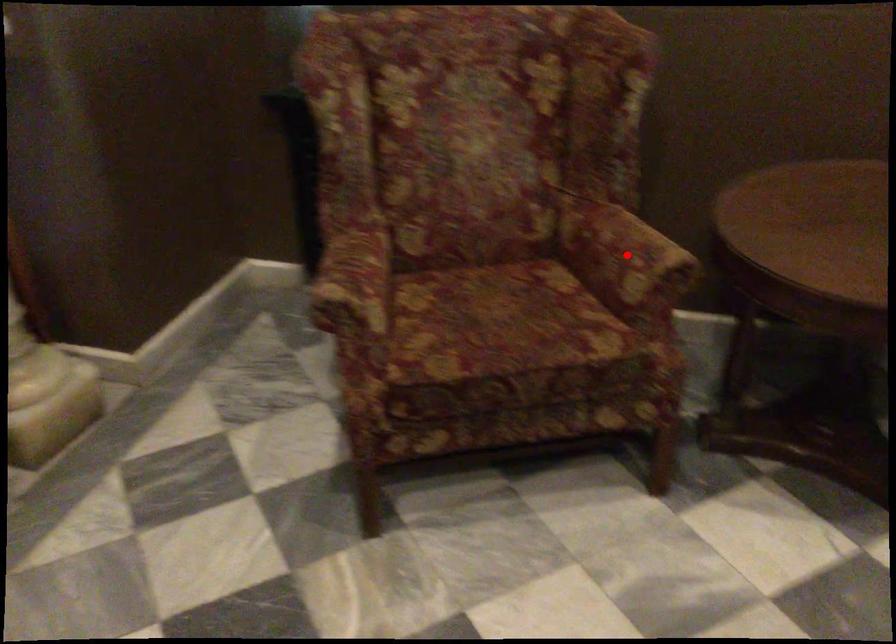
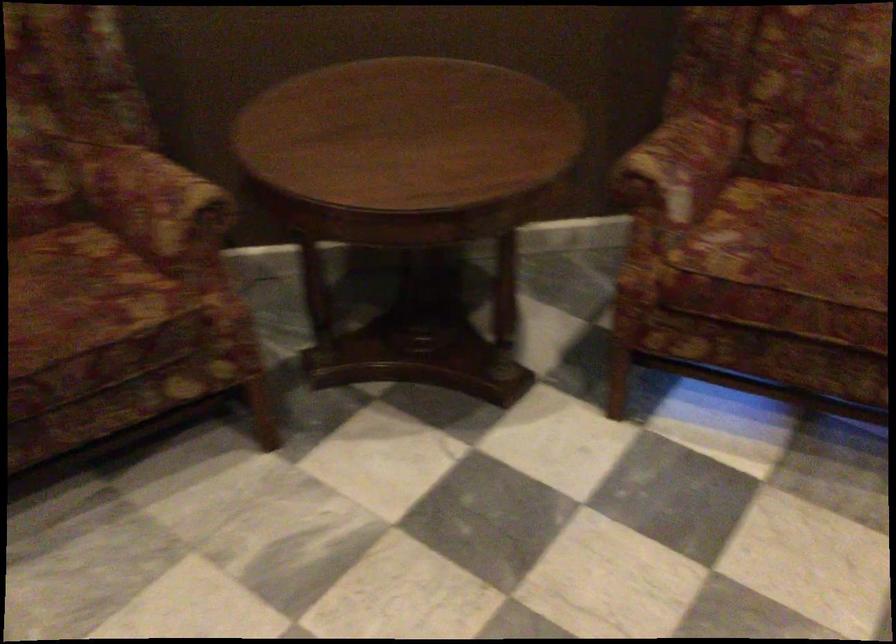
Question: I am providing you with two images of the same scene from different viewpoints. Given a red point in image1, look at the same physical point in image2. Is it:

Choices:
 (A) Closer to the viewpoint
 (B) Farther from the viewpoint

Answer: (A)